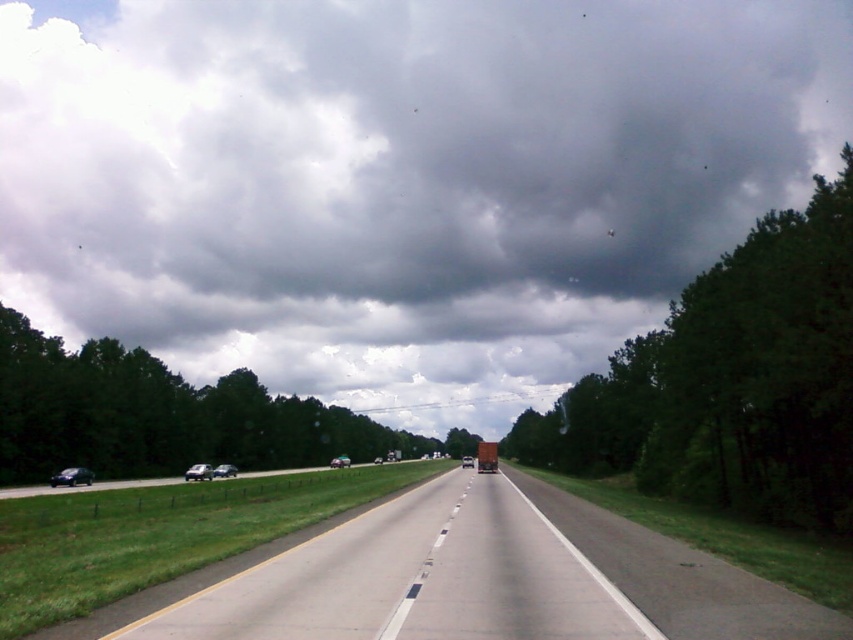
Question: Based on their relative distances, which object is farther from the green leafy tree at left?

Choices:
 (A) dark gray cloud at upper center
 (B) metallic silver trailer truck at center
 (C) shiny black car at lower left

Answer: (A)

Question: Which of the following is the farthest from the observer?

Choices:
 (A) (55, 483)
 (B) (514, 531)

Answer: (A)

Question: Estimate the real-world distances between objects in this image. Which object is farther from the dark gray cloud at upper center?

Choices:
 (A) silver metallic sedan at center
 (B) green leafy tree at right

Answer: (A)

Question: Considering the relative positions of metallic silver trailer truck at center and silver metallic sedan at center in the image provided, where is metallic silver trailer truck at center located with respect to silver metallic sedan at center?

Choices:
 (A) above
 (B) below

Answer: (A)

Question: Can you confirm if dark gray cloud at upper center is thinner than green leafy tree at right?

Choices:
 (A) no
 (B) yes

Answer: (A)

Question: Does shiny black car at lower left appear over silver metallic sedan at center?

Choices:
 (A) yes
 (B) no

Answer: (A)